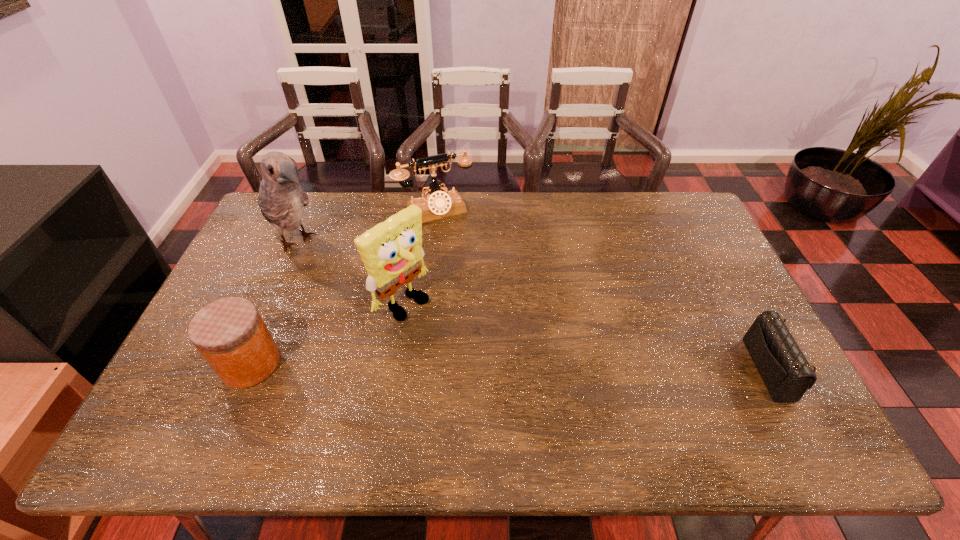
This screenshot has height=540, width=960. I want to click on blank space located 0.210m on the face of the sponge, so click(475, 358).

Locate an element on the screen. The image size is (960, 540). vacant space located 0.190m on the front-facing side of the tallest object is located at coordinates (355, 287).

This screenshot has height=540, width=960. What are the coordinates of `blank area located 0.340m on the front-facing side of the tallest object` in the screenshot? It's located at (387, 312).

This screenshot has height=540, width=960. Find the location of `vacant space located on the front-facing side of the tallest object`. vacant space located on the front-facing side of the tallest object is located at coordinates (328, 265).

Where is `vacant space located 0.390m on the dial of the third shortest object`? This screenshot has width=960, height=540. vacant space located 0.390m on the dial of the third shortest object is located at coordinates (491, 303).

You are a GUI agent. You are given a task and a screenshot of the screen. Output one action in this format:
    pyautogui.click(x=<x>, y=<y>)
    Task: Click on the free region located 0.060m on the dial of the third shortest object
    The height and width of the screenshot is (540, 960).
    Given the screenshot: What is the action you would take?
    click(x=454, y=234)

You are a GUI agent. You are given a task and a screenshot of the screen. Output one action in this format:
    pyautogui.click(x=<x>, y=<y>)
    Task: Click on the free location located 0.340m on the dial of the third shortest object
    The height and width of the screenshot is (540, 960).
    Given the screenshot: What is the action you would take?
    pyautogui.click(x=485, y=291)

This screenshot has width=960, height=540. Find the location of `parrot present at the far edge`. parrot present at the far edge is located at coordinates (282, 199).

At what (x,y) coordinates should I click in order to perform the action: click on telephone positioned at the far edge. Please return your answer as a coordinate pair (x, y). This screenshot has height=540, width=960. Looking at the image, I should click on (437, 204).

Locate an element on the screen. jar present at the near edge is located at coordinates (230, 334).